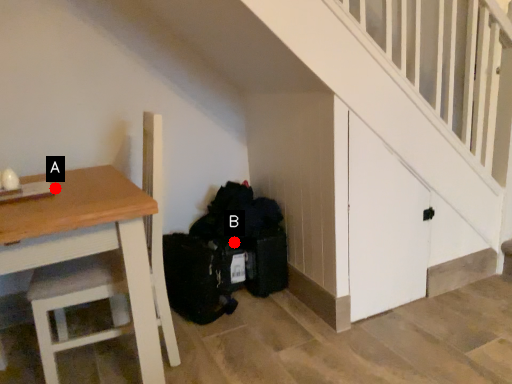
Question: Two points are circled on the image, labeled by A and B beside each circle. Which point appears closest to the camera in this image?

Choices:
 (A) A is closer
 (B) B is closer

Answer: (A)